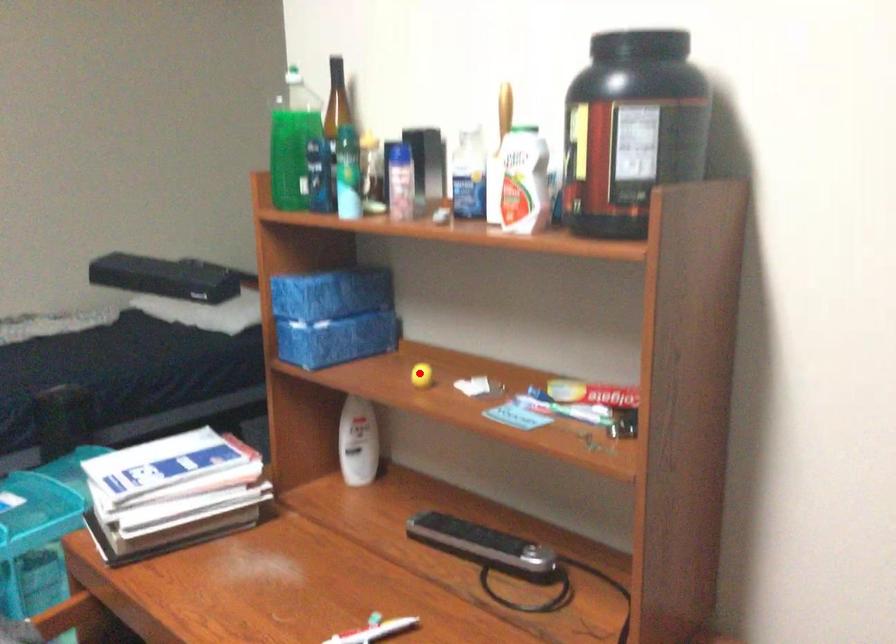
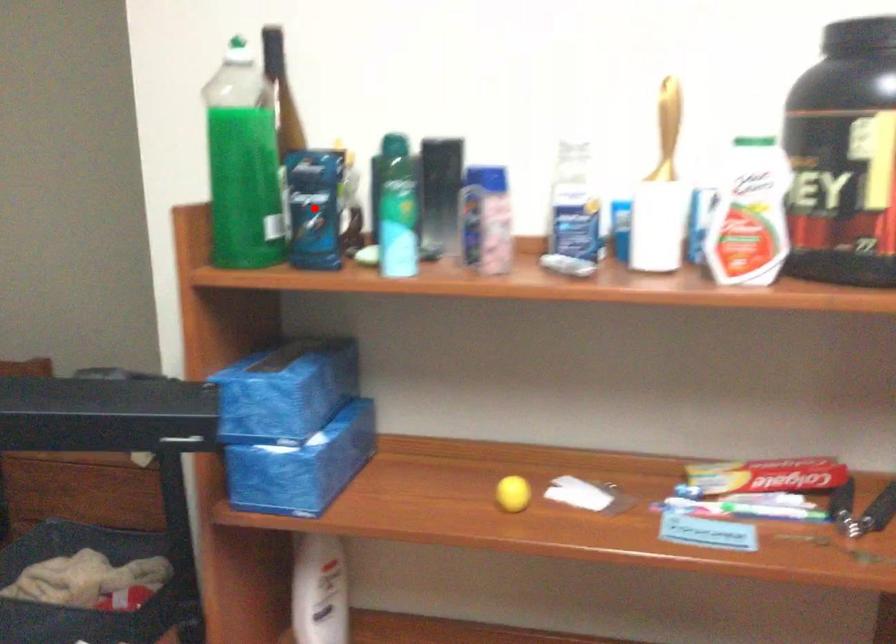
I am providing you with two images of the same scene from different viewpoints. A red point is marked on the first image and another point is marked on the second image. Is the marked point in image1 the same physical position as the marked point in image2?

No